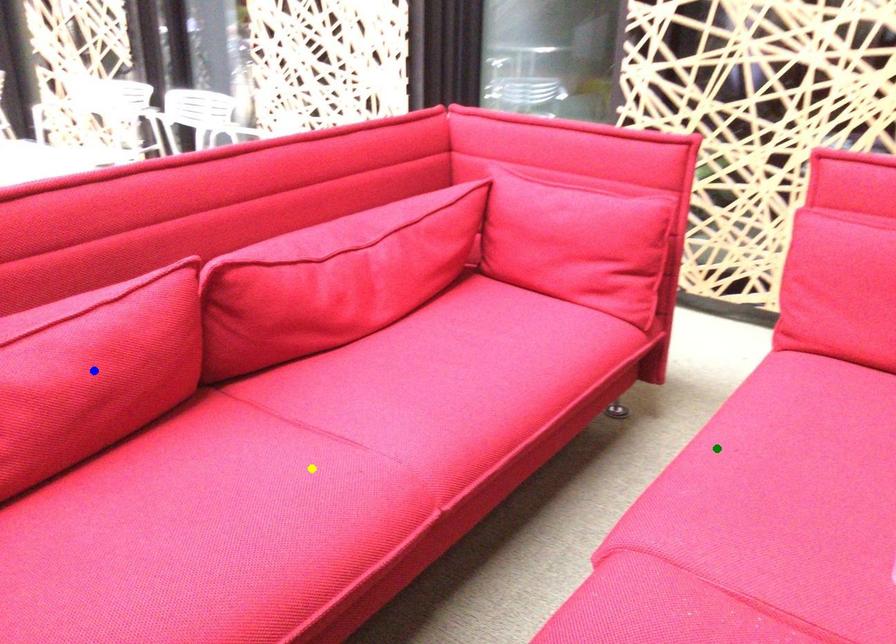
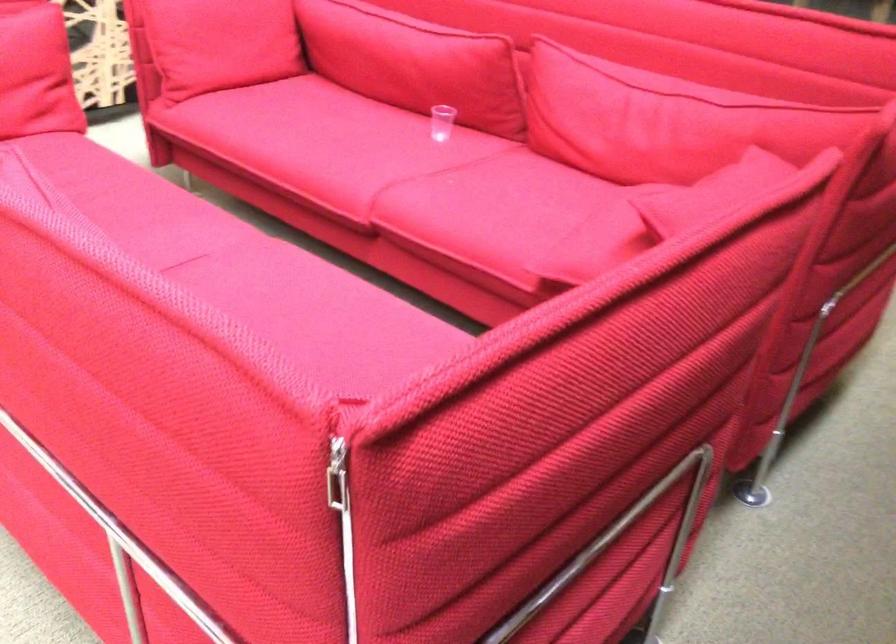
I am providing you with two images of the same scene from different viewpoints. Three points are marked in image1. Which point corresponds to a part or object that is occluded in image2?In image1, three points are marked. Which of them correspond to a part or object that is occluded in image2?Among the three points shown in image1, which one corresponds to a part or object that is no longer visible due to occlusion in image2?

blue point cannot be seen in image2.